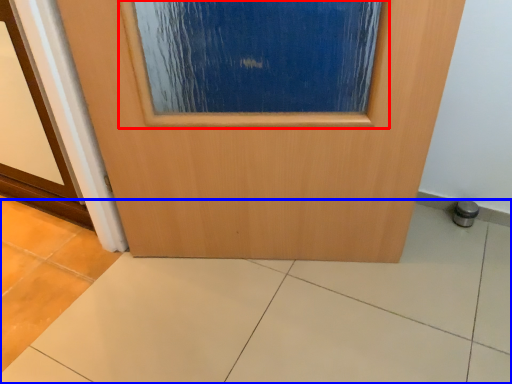
Question: Which of the following is the farthest to the observer, airplane window (highlighted by a red box) or ceramic tile (highlighted by a blue box)?

Choices:
 (A) airplane window
 (B) ceramic tile

Answer: (A)